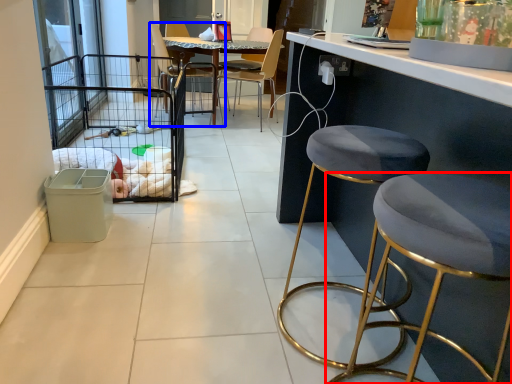
Question: Which object appears closest to the camera in this image, stool (highlighted by a red box) or chair (highlighted by a blue box)?

Choices:
 (A) stool
 (B) chair

Answer: (A)